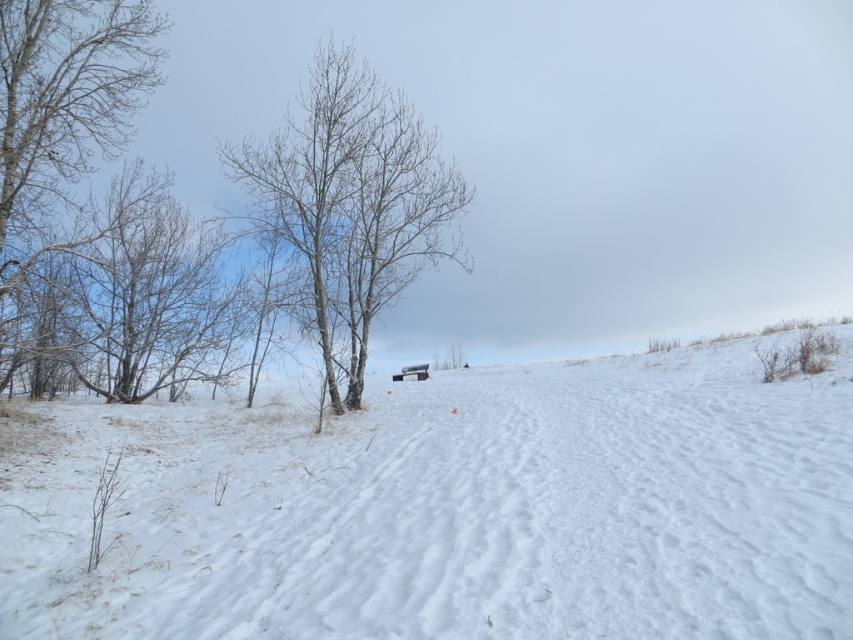
Who is shorter, bare wood tree at center or smooth white tree at left?

smooth white tree at left

The width and height of the screenshot is (853, 640). What do you see at coordinates (352, 204) in the screenshot? I see `bare wood tree at center` at bounding box center [352, 204].

The height and width of the screenshot is (640, 853). I want to click on bare wood tree at center, so click(x=352, y=204).

Who is lower down, white snow ski slope at center or bare branches at left?

white snow ski slope at center is below.

Does white snow ski slope at center have a greater width compared to bare branches at left?

Yes.

Describe the element at coordinates (448, 508) in the screenshot. I see `white snow ski slope at center` at that location.

Find the location of `white snow ski slope at center`. white snow ski slope at center is located at coordinates (448, 508).

Which of these two, white snow ski slope at center or smooth white tree at left, stands taller?

smooth white tree at left is taller.

Is point (447, 627) farther from viewer compared to point (187, 296)?

No, (447, 627) is in front of (187, 296).

Does point (782, 627) lie behind point (12, 326)?

No, (782, 627) is closer to viewer.

Where is `white snow ski slope at center`? The height and width of the screenshot is (640, 853). white snow ski slope at center is located at coordinates (448, 508).